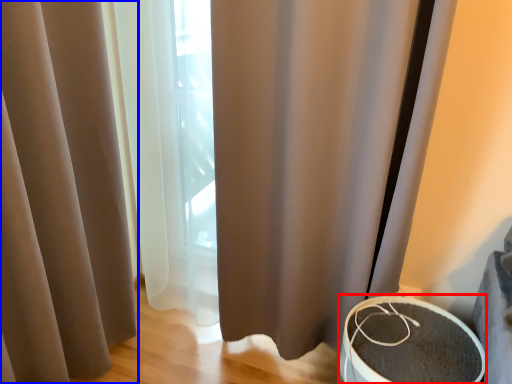
Question: Which of the following is the closest to the observer, round table (highlighted by a red box) or curtain (highlighted by a blue box)?

Choices:
 (A) round table
 (B) curtain

Answer: (B)